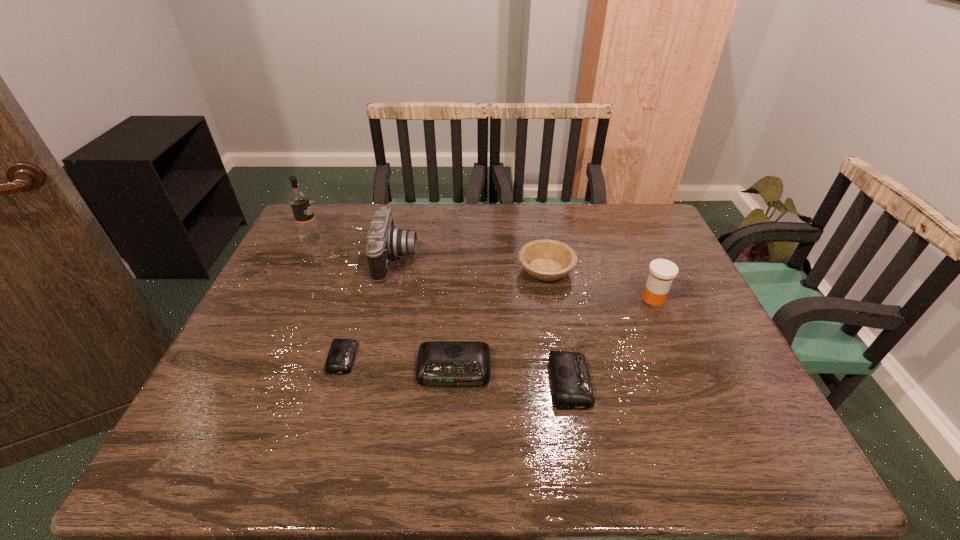
You are a GUI agent. You are given a task and a screenshot of the screen. Output one action in this format:
    pyautogui.click(x=<x>, y=<y>)
    Task: Click on the camera present at the far edge
    The image size is (960, 540).
    Given the screenshot: What is the action you would take?
    pyautogui.click(x=385, y=241)

The width and height of the screenshot is (960, 540). Find the location of `vodka at the far edge`. vodka at the far edge is located at coordinates (299, 200).

I want to click on object that is at the left edge, so click(299, 200).

The image size is (960, 540). I want to click on object present at the right edge, so click(x=662, y=272).

Image resolution: width=960 pixels, height=540 pixels. What are the coordinates of `object present at the far left corner` in the screenshot? It's located at (299, 200).

At what (x,y) coordinates should I click in order to perform the action: click on blank area at the far edge. Please return your answer as a coordinate pair (x, y). This screenshot has width=960, height=540. Looking at the image, I should click on (571, 235).

In the image, there is a desktop. At what (x,y) coordinates should I click in order to perform the action: click on blank space at the near edge. Please return your answer as a coordinate pair (x, y). The width and height of the screenshot is (960, 540). Looking at the image, I should click on (479, 403).

Locate an element on the screen. This screenshot has height=540, width=960. vacant space at the left edge of the desktop is located at coordinates (323, 278).

At what (x,y) coordinates should I click in order to perform the action: click on vacant space at the right edge of the desktop. Please return your answer as a coordinate pair (x, y). Looking at the image, I should click on (704, 356).

The width and height of the screenshot is (960, 540). I want to click on free space at the far right corner of the desktop, so click(x=644, y=221).